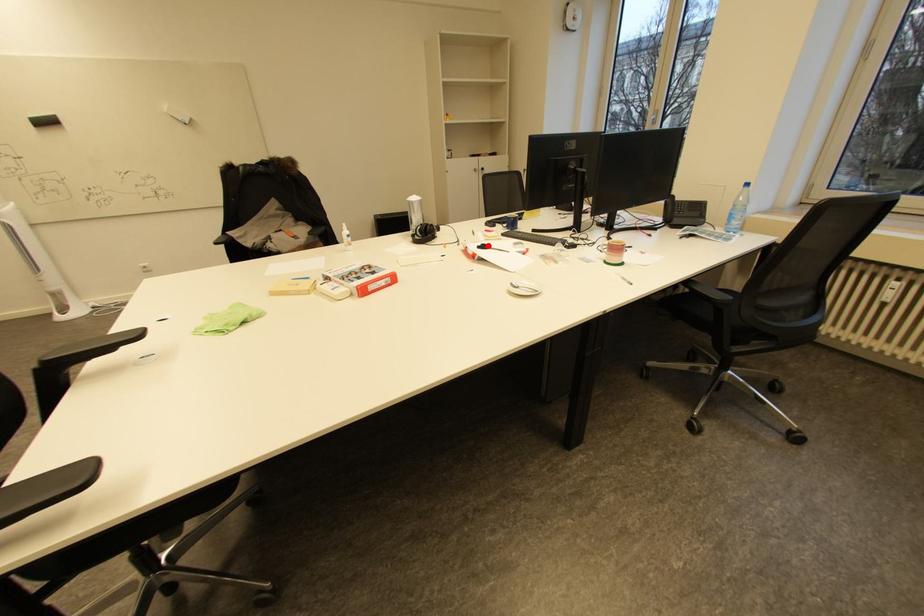
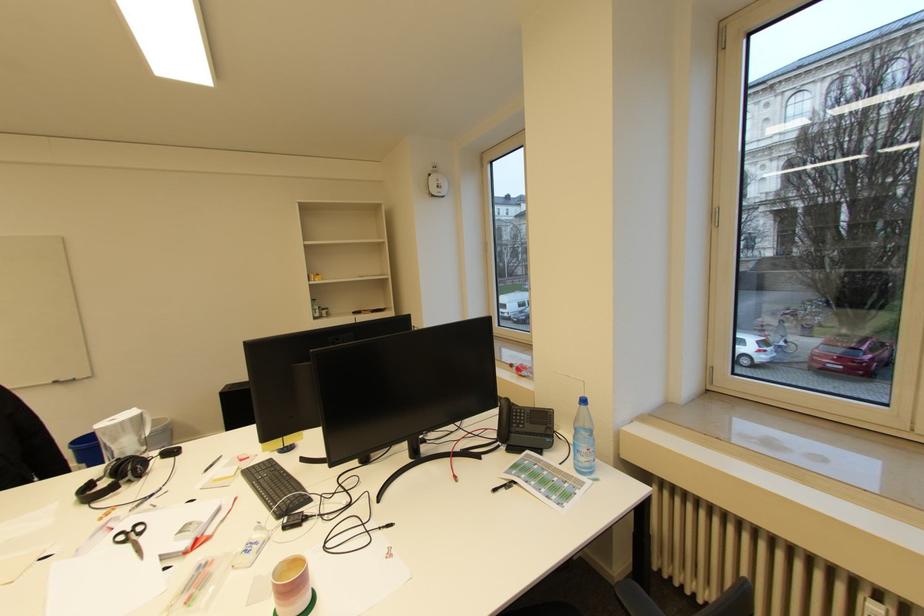
Where in the second image is the point corresponding to the highlighted location from the first image?

(141, 525)